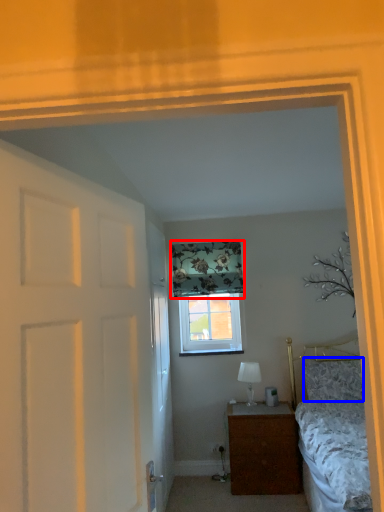
Question: Among these objects, which one is nearest to the camera, curtain (highlighted by a red box) or pillow (highlighted by a blue box)?

Choices:
 (A) curtain
 (B) pillow

Answer: (B)